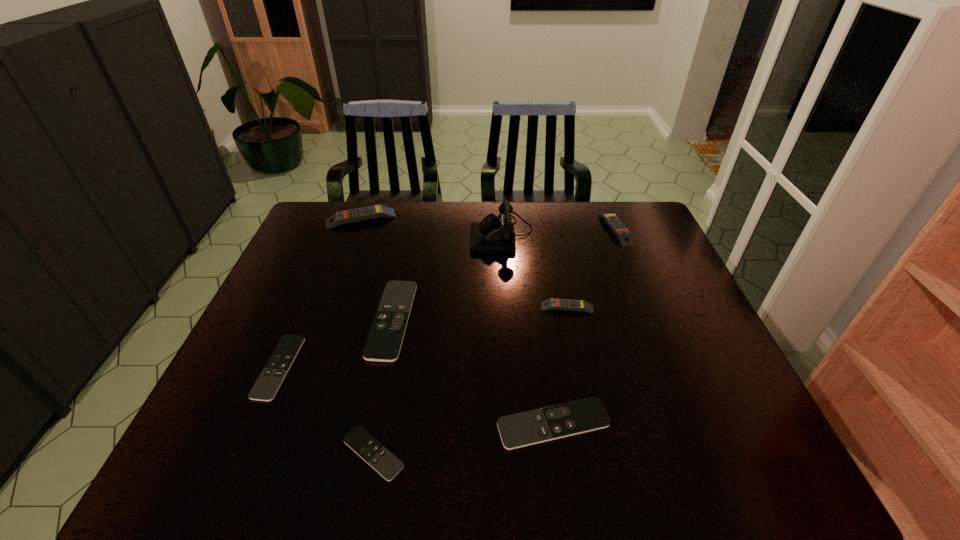
Select which yellow remote control appears as the second closest to the tallest remote control. Please provide its 2D coordinates. Your answer should be formatted as a tuple, i.e. [(x, y)], where the tuple contains the x and y coordinates of a point satisfying the conditions above.

[(624, 236)]

The width and height of the screenshot is (960, 540). What are the coordinates of `the second closest black remote control to the second biggest black remote control` in the screenshot? It's located at (384, 342).

Identify the location of the third closest black remote control to the fifth tallest object. (518, 430).

You are a GUI agent. You are given a task and a screenshot of the screen. Output one action in this format:
    pyautogui.click(x=<x>, y=<y>)
    Task: Click on the vacant space that satisfies the following two spatial constraints: 1. on the front face of the tallest object; 2. on the left side of the second yellow remote control from left to right
    Image resolution: width=960 pixels, height=540 pixels.
    Given the screenshot: What is the action you would take?
    pyautogui.click(x=507, y=308)